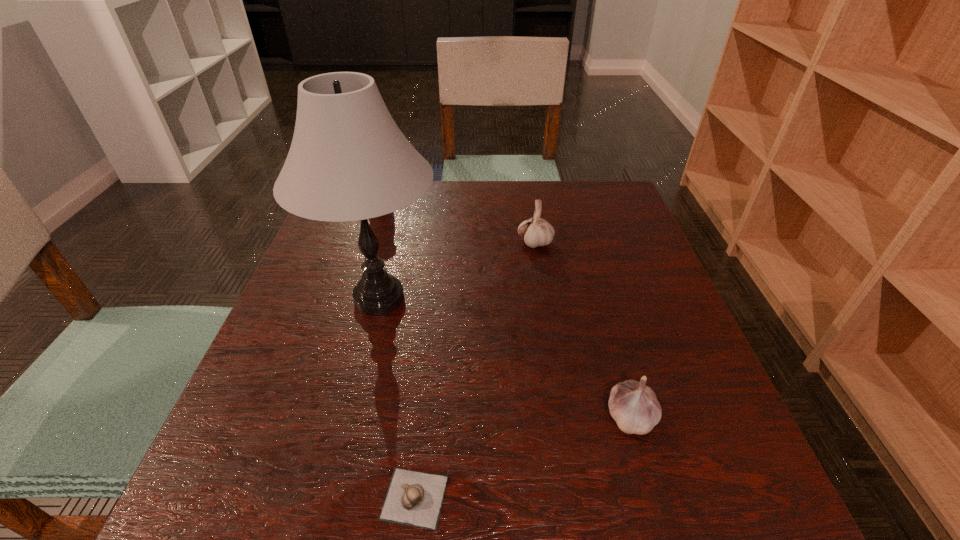
Find the location of a particular element. Image resolution: width=960 pixels, height=540 pixels. lamp is located at coordinates (348, 161).

You are a GUI agent. You are given a task and a screenshot of the screen. Output one action in this format:
    pyautogui.click(x=<x>, y=<y>)
    Task: Click on the tallest object
    
    Given the screenshot: What is the action you would take?
    pyautogui.click(x=348, y=161)

In order to click on the third object from left to right in this screenshot , I will do `click(537, 232)`.

At what (x,y) coordinates should I click in order to perform the action: click on the farthest garlic. Please return your answer as a coordinate pair (x, y). Image resolution: width=960 pixels, height=540 pixels. Looking at the image, I should click on (537, 232).

The height and width of the screenshot is (540, 960). I want to click on the rightmost garlic, so click(633, 405).

You are a GUI agent. You are given a task and a screenshot of the screen. Output one action in this format:
    pyautogui.click(x=<x>, y=<y>)
    Task: Click on the second nearest garlic
    
    Given the screenshot: What is the action you would take?
    pyautogui.click(x=633, y=405)

I want to click on the nearest garlic, so click(414, 498).

The image size is (960, 540). Find the location of `the nearest object`. the nearest object is located at coordinates (414, 498).

This screenshot has width=960, height=540. What are the coordinates of `blank area located on the front of the lamp` in the screenshot? It's located at (333, 484).

The width and height of the screenshot is (960, 540). I want to click on vacant point located 0.210m on the left of the second garlic from right to left, so click(x=432, y=243).